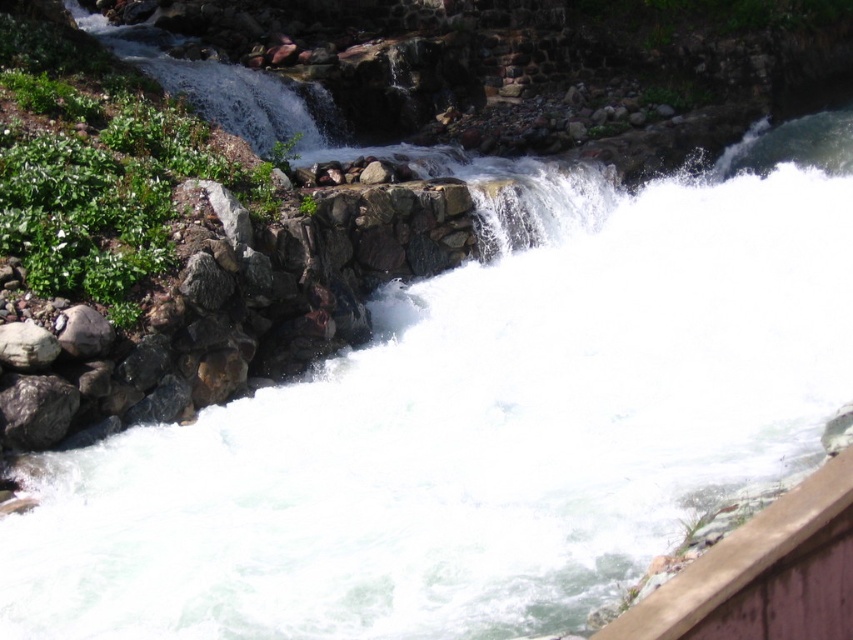
In the scene shown: You are a hiker trying to cross the river using the brown wooden ledge at lower right and the gray rough rock at left. Which object should you step on first if you are approaching from the right side of the river?

You should step on the gray rough rock at left first because the brown wooden ledge at lower right is to the right of it, so the gray rough rock at left is closer to your starting position on the right side of the river.

You are a hiker carrying a backpack and need to cross the river. You see the brown wooden ledge at lower right and the gray rough rock at left. How far apart are these two points where you might place your feet?

The brown wooden ledge at lower right and the gray rough rock at left are 6.89 meters apart.